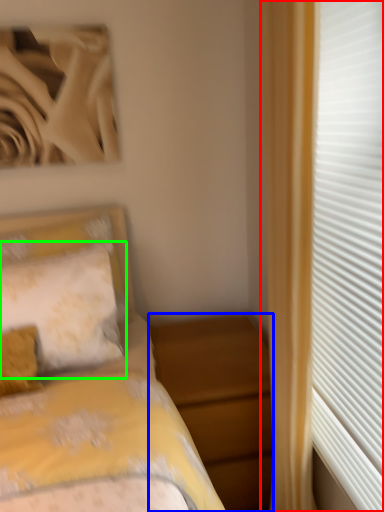
Question: Considering the real-world distances, which object is farthest from curtain (highlighted by a red box)? nightstand (highlighted by a blue box) or pillow (highlighted by a green box)?

Choices:
 (A) nightstand
 (B) pillow

Answer: (B)